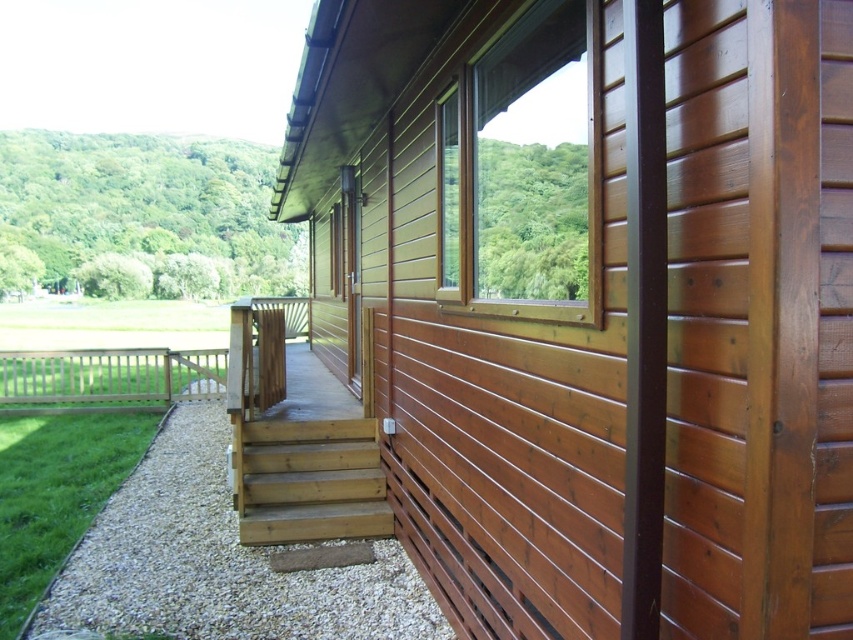
Does white gravel at lower left have a greater height compared to brown wooden window at center?

No, white gravel at lower left is not taller than brown wooden window at center.

This screenshot has height=640, width=853. Find the location of `white gravel at lower left`. white gravel at lower left is located at coordinates (218, 563).

Between point (125, 602) and point (546, 4), which one is positioned in front?

Point (546, 4) is in front.

Find the location of `white gravel at lower left`. white gravel at lower left is located at coordinates (218, 563).

Which is above, natural wood stairs at center or brown wooden balustrade at left?

brown wooden balustrade at left

You are a GUI agent. You are given a task and a screenshot of the screen. Output one action in this format:
    pyautogui.click(x=<x>, y=<y>)
    Task: Click on the natural wood stairs at center
    
    Given the screenshot: What is the action you would take?
    pyautogui.click(x=308, y=481)

I want to click on natural wood stairs at center, so click(x=308, y=481).

In the scene shown: Who is higher up, brown wooden window at center or brown wooden balustrade at left?

brown wooden window at center

What do you see at coordinates (527, 172) in the screenshot?
I see `brown wooden window at center` at bounding box center [527, 172].

Who is more distant from viewer, [471,288] or [53,397]?

Positioned behind is point [53,397].

Image resolution: width=853 pixels, height=640 pixels. What are the coordinates of `brown wooden window at center` in the screenshot? It's located at (527, 172).